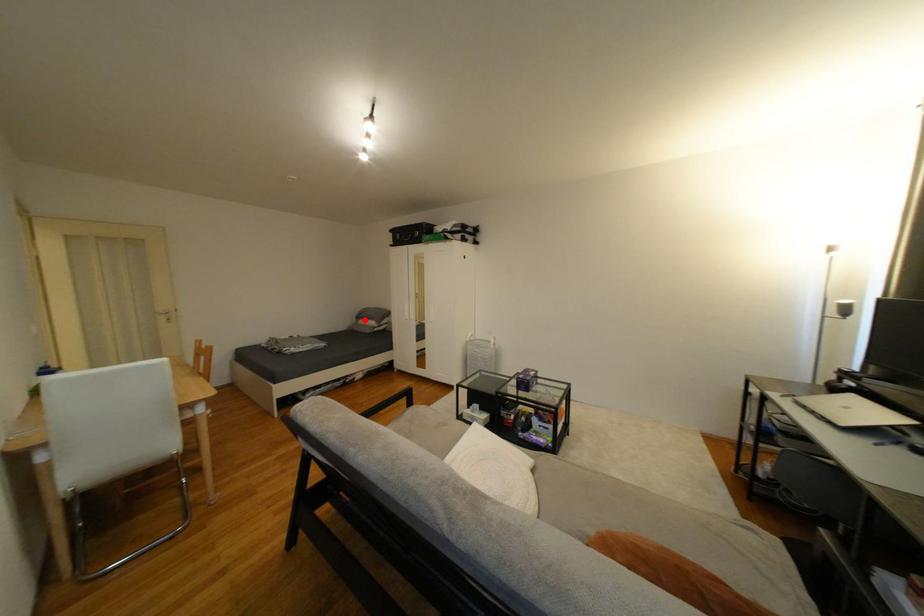
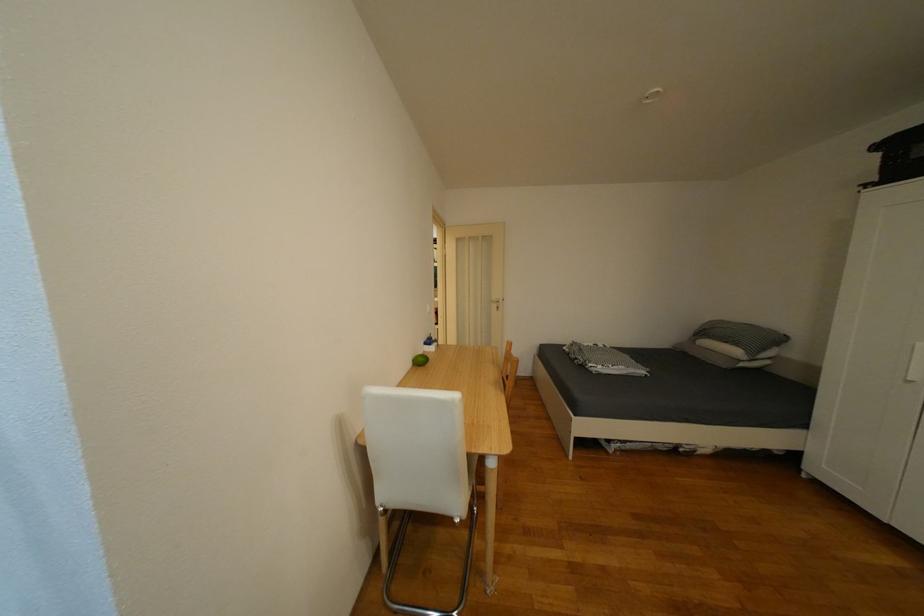
In the second image, find the point that corresponds to the highlighted location in the first image.

(702, 337)